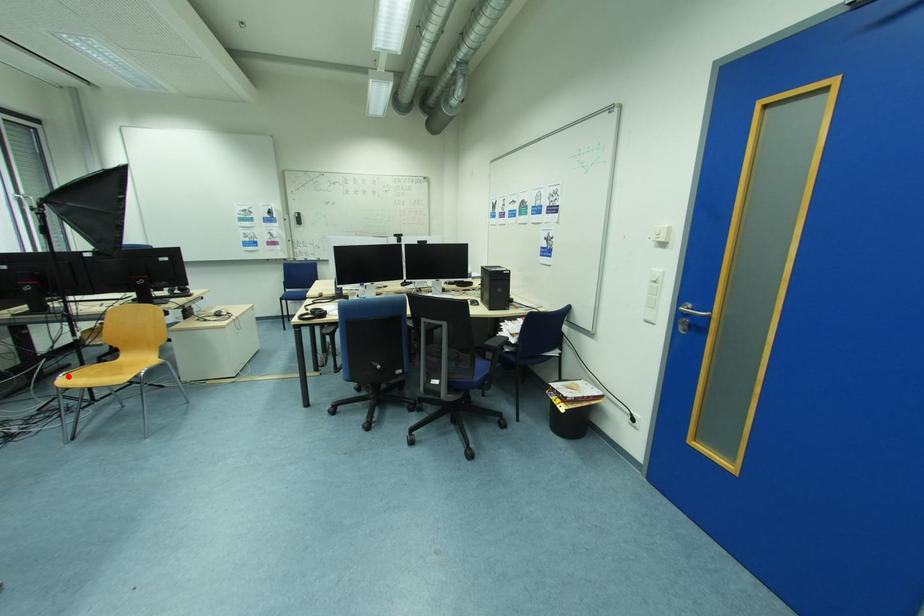
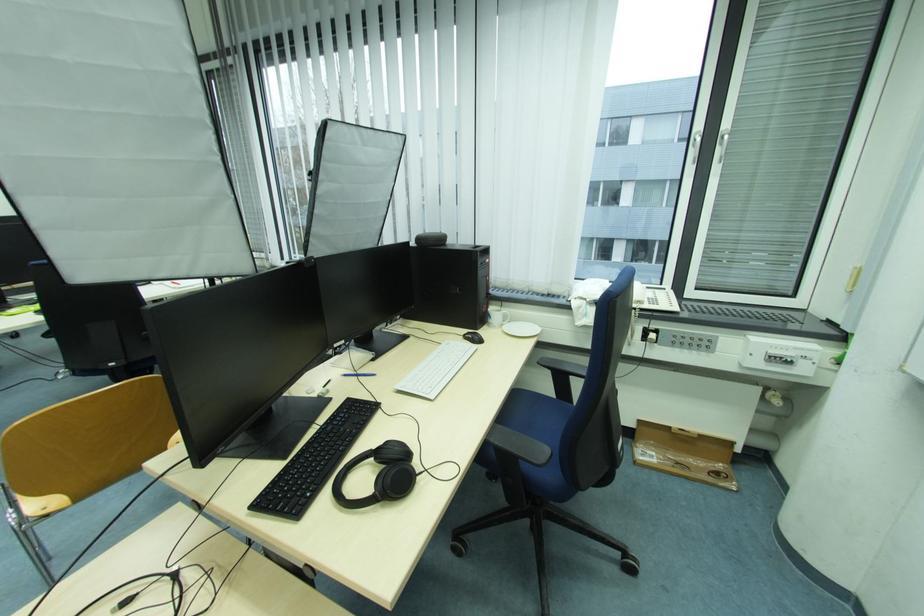
Question: I am providing you with two images of the same scene from different viewpoints. A red point is marked on the first image. Is the red point's position out of view in image 2?

Choices:
 (A) Yes
 (B) No

Answer: (A)